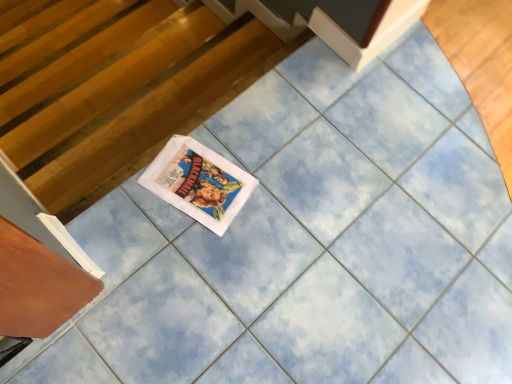
Where is `spots to the right of white paper comic book at center`? This screenshot has height=384, width=512. spots to the right of white paper comic book at center is located at coordinates (274, 209).